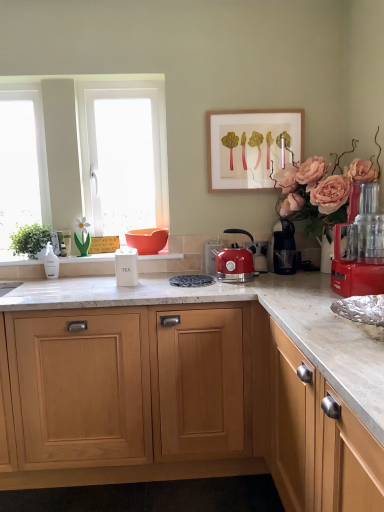
Question: Looking at their shapes, would you say white matte tea container at center, the second kitchen appliance in the left-to-right sequence, is wider or thinner than green leafy plant at left?

Choices:
 (A) wide
 (B) thin

Answer: (B)

Question: In the image, is white matte tea container at center, the second kitchen appliance in the left-to-right sequence, positioned in front of or behind green leafy plant at left?

Choices:
 (A) front
 (B) behind

Answer: (A)

Question: Estimate the real-world distances between objects in this image. Which object is closer to the matte red kettle at center, the 4th kitchen appliance when ordered from left to right?

Choices:
 (A) black plastic coffee machine at right, the 2th coffee machine from the back
 (B) white glass window at left
 (C) white glossy bottle at left, which appears as the 5th kitchen appliance when viewed from the right
 (D) green leafy plant at left
 (E) white frosted glass at left

Answer: (A)

Question: Considering the real-world distances, which object is farthest from the light wood cabinet at center?

Choices:
 (A) white glossy window sill at center
 (B) wooden picture frame at upper center
 (C) white matte tea container at center, the second kitchen appliance in the left-to-right sequence
 (D) metallic silver toaster at center, which appears as the second kitchen appliance when viewed from the back
 (E) metallic red food processor at right, the 1th kitchen appliance when ordered from right to left

Answer: (B)